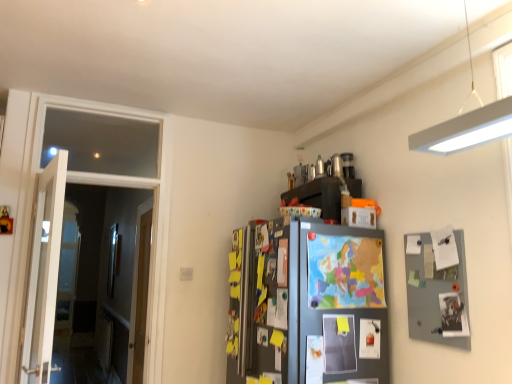
Question: Is clear glass door at left inside wooden door at left, which ranks as the second door in front-to-back order?

Choices:
 (A) no
 (B) yes

Answer: (A)

Question: From the image's perspective, is wooden door at left, which is counted as the 1th door, starting from the back, on clear glass door at left?

Choices:
 (A) yes
 (B) no

Answer: (B)

Question: Is wooden door at left, which ranks as the second door in front-to-back order, oriented towards clear glass door at left?

Choices:
 (A) no
 (B) yes

Answer: (A)

Question: Does wooden door at left, which is counted as the 1th door, starting from the back, have a greater width compared to clear glass door at left?

Choices:
 (A) no
 (B) yes

Answer: (B)

Question: Is wooden door at left, which ranks as the second door in front-to-back order, thinner than clear glass door at left?

Choices:
 (A) yes
 (B) no

Answer: (B)

Question: Considering the relative positions of wooden door at left, which ranks as the second door in front-to-back order, and clear glass door at left in the image provided, is wooden door at left, which ranks as the second door in front-to-back order, to the right of clear glass door at left from the viewer's perspective?

Choices:
 (A) yes
 (B) no

Answer: (A)

Question: Would you consider matte black cabinet at upper right to be distant from white wooden door at left, positioned as the second door in back-to-front order?

Choices:
 (A) yes
 (B) no

Answer: (A)

Question: Can you confirm if matte black cabinet at upper right is taller than white wooden door at left, positioned as the second door in back-to-front order?

Choices:
 (A) no
 (B) yes

Answer: (A)

Question: From the image's perspective, is matte black cabinet at upper right on white wooden door at left, the 1th door viewed from the front?

Choices:
 (A) no
 (B) yes

Answer: (B)

Question: Does matte black cabinet at upper right appear on the right side of white wooden door at left, positioned as the second door in back-to-front order?

Choices:
 (A) no
 (B) yes

Answer: (B)

Question: Is matte black cabinet at upper right at the left side of white wooden door at left, positioned as the second door in back-to-front order?

Choices:
 (A) yes
 (B) no

Answer: (B)

Question: Is matte black cabinet at upper right thinner than white wooden door at left, the 1th door viewed from the front?

Choices:
 (A) yes
 (B) no

Answer: (B)

Question: Is matte black cabinet at upper right positioned far away from wooden door at left, which is counted as the 1th door, starting from the back?

Choices:
 (A) yes
 (B) no

Answer: (A)